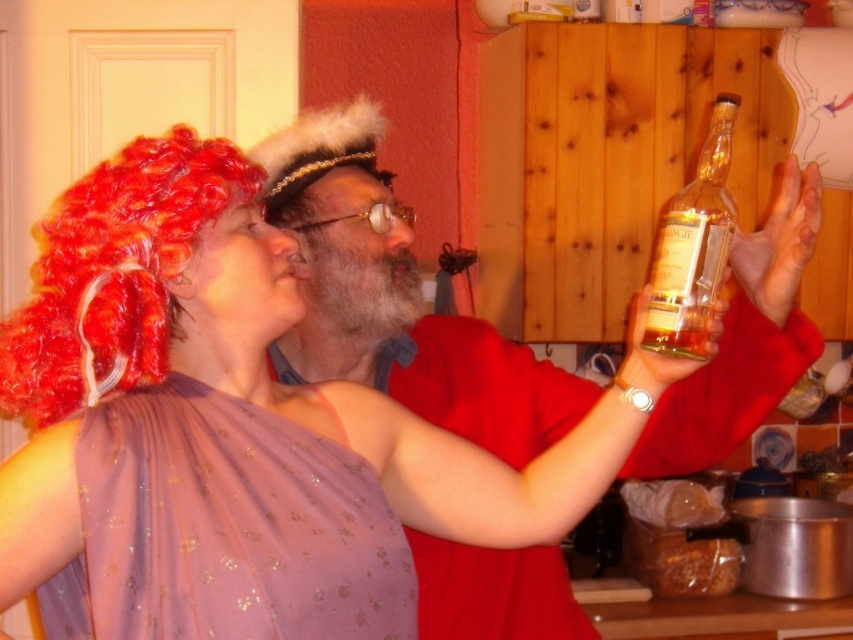
You are standing in the kitchen and want to reach the point at coordinates (158, 451). Your arm can extend 30 inches. Can you reach that point?

The point at coordinates (158, 451) is 33.70 inches from the viewer, which is beyond your arm extension of 30 inches. You cannot reach it.

What are the coordinates of the purple satin dress at upper left in the image?

The coordinates of the purple satin dress at upper left are at point (225, 529).

You are at a party and want to place a small decoration on the purple satin dress at upper left and the clear glass bottle at upper right. Which object is shorter and thus better suited for placing the decoration without it falling over?

The purple satin dress at upper left is shorter than the clear glass bottle at upper right, so it would be better to place the decoration on the purple satin dress at upper left to prevent it from falling over.